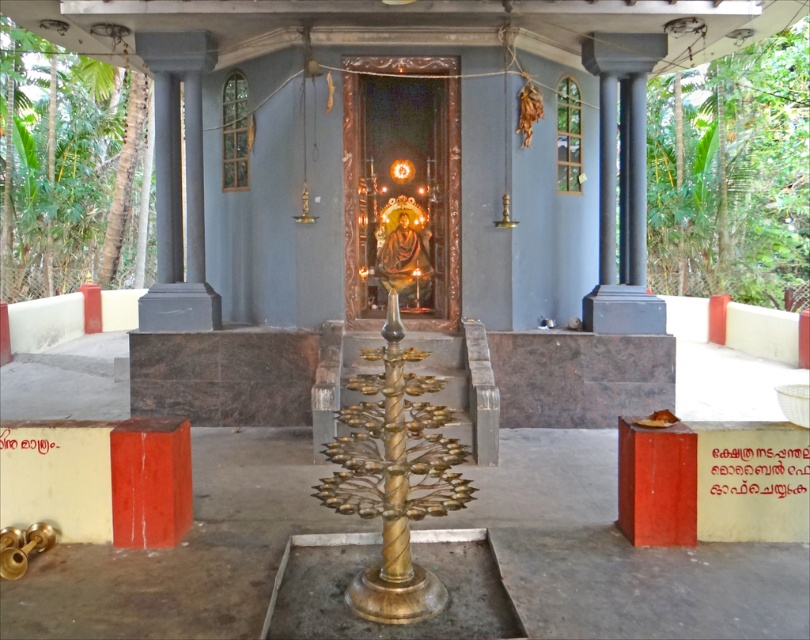
Question: Which point appears closest to the camera in this image?

Choices:
 (A) (1, 90)
 (B) (755, 168)

Answer: (B)

Question: Among these objects, which one is farthest from the camera?

Choices:
 (A) green leafy tree at right
 (B) green leafy tree at left

Answer: (B)

Question: Which point is farther to the camera?

Choices:
 (A) green leafy tree at right
 (B) green leafy tree at left

Answer: (B)

Question: Is green leafy tree at right thinner than green leafy tree at left?

Choices:
 (A) yes
 (B) no

Answer: (B)

Question: Can you confirm if green leafy tree at right is positioned above green leafy tree at left?

Choices:
 (A) no
 (B) yes

Answer: (A)

Question: Does green leafy tree at right have a larger size compared to green leafy tree at left?

Choices:
 (A) yes
 (B) no

Answer: (A)